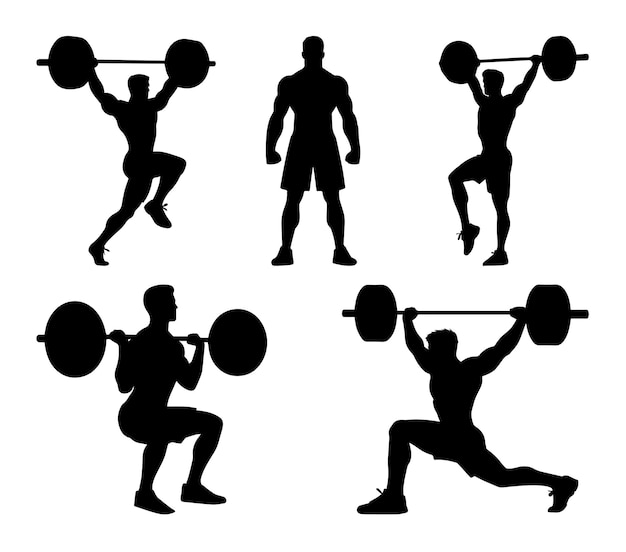
Image resolution: width=626 pixels, height=552 pixels. Find the location of `chests`. chests is located at coordinates (140, 120), (310, 97), (491, 119), (444, 391), (168, 359).